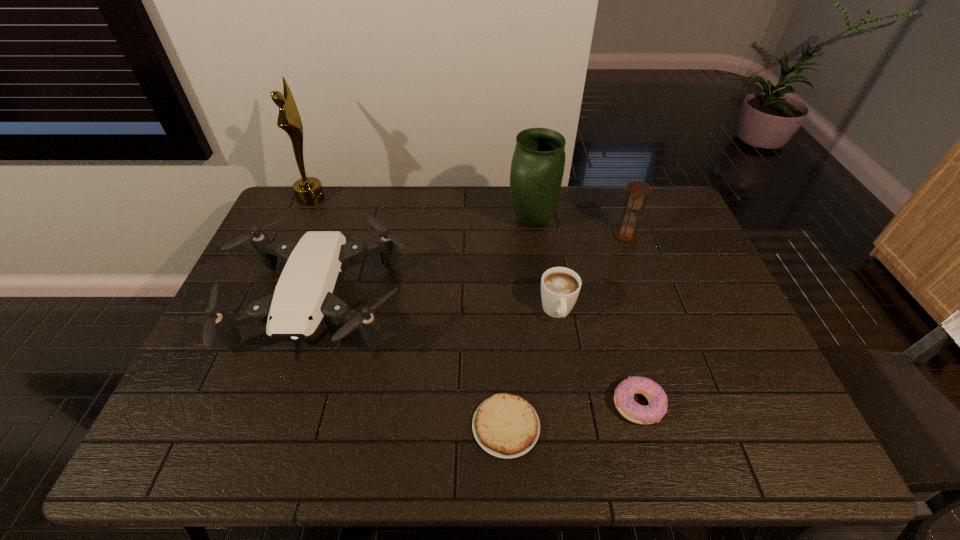
At what (x,y) coordinates should I click in order to perform the action: click on award. Please return your answer as a coordinate pair (x, y). Looking at the image, I should click on (308, 190).

Identify the location of vase. (538, 162).

Find the location of a particular element. Image resolution: width=960 pixels, height=540 pixels. the fifth shortest object is located at coordinates (637, 189).

Where is `the rightmost object`? This screenshot has height=540, width=960. the rightmost object is located at coordinates (637, 189).

At what (x,y) coordinates should I click in order to perform the action: click on drone. Please return your answer as a coordinate pair (x, y). The height and width of the screenshot is (540, 960). Looking at the image, I should click on (305, 301).

Locate an element on the screen. The height and width of the screenshot is (540, 960). cappuccino is located at coordinates (560, 286).

Find the location of a particular element. Image resolution: width=960 pixels, height=540 pixels. the second object from right to left is located at coordinates (624, 401).

The height and width of the screenshot is (540, 960). Find the location of `the sixth tallest object`. the sixth tallest object is located at coordinates (624, 401).

Identify the location of tortilla. (506, 426).

Where is `vacant space located on the front-facing side of the award`? vacant space located on the front-facing side of the award is located at coordinates click(x=361, y=198).